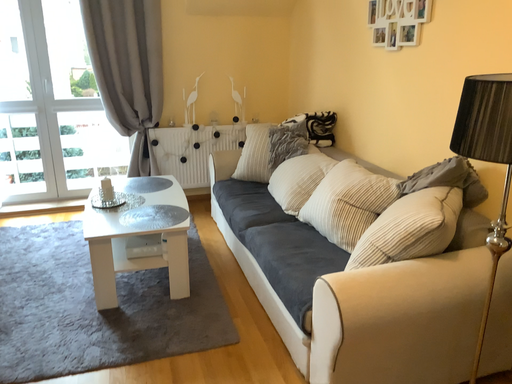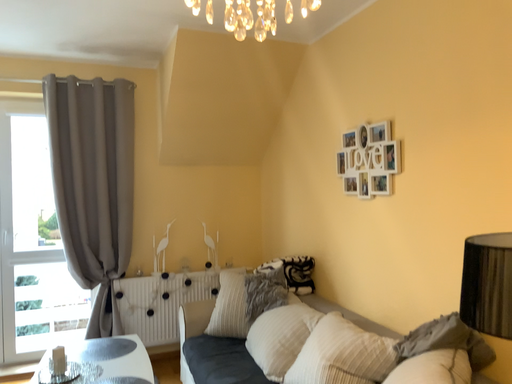
Question: How did the camera likely rotate when shooting the video?

Choices:
 (A) rotated downward
 (B) rotated upward

Answer: (B)